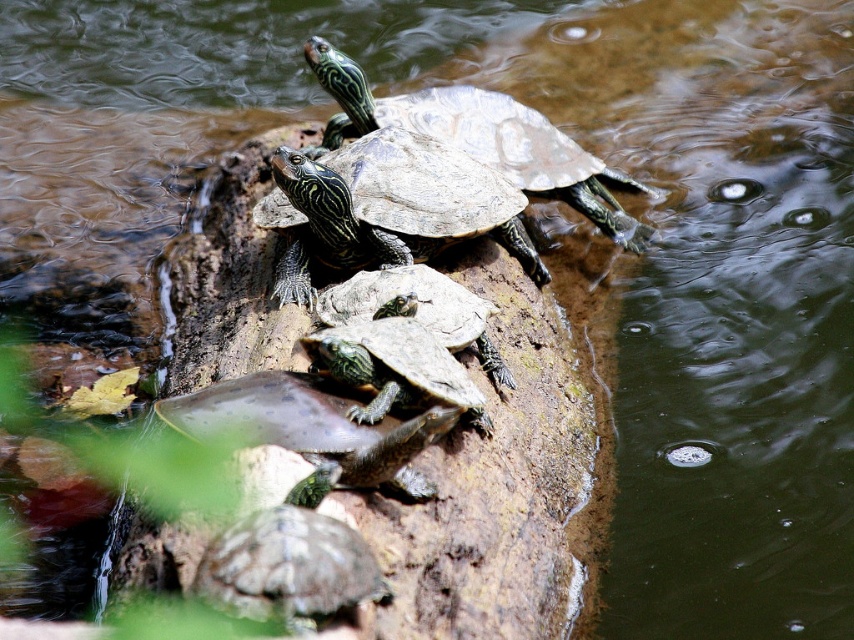
Can you confirm if shiny dark green tortoise at center is bigger than green textured tortoise at center?

Indeed, shiny dark green tortoise at center has a larger size compared to green textured tortoise at center.

Is point (285, 280) farther from camera compared to point (471, 323)?

Yes, point (285, 280) is behind point (471, 323).

Locate an element on the screen. Image resolution: width=854 pixels, height=640 pixels. shiny dark green tortoise at center is located at coordinates (385, 209).

The height and width of the screenshot is (640, 854). Find the location of `shiny dark green tortoise at center`. shiny dark green tortoise at center is located at coordinates (385, 209).

Is green scaly tortoise at center positioned in front of shiny green tortoise at lower center?

No, green scaly tortoise at center is behind shiny green tortoise at lower center.

Is green scaly tortoise at center below shiny green tortoise at lower center?

Actually, green scaly tortoise at center is above shiny green tortoise at lower center.

Which is behind, point (185, 403) or point (303, 493)?

The point (185, 403) is behind.

This screenshot has width=854, height=640. Find the location of `green scaly tortoise at center`. green scaly tortoise at center is located at coordinates [x=313, y=428].

Can you confirm if shiny dark green tortoise at center is positioned below green scaly turtle at center?

Incorrect, shiny dark green tortoise at center is not positioned below green scaly turtle at center.

Between shiny dark green tortoise at center and green scaly turtle at center, which one has less height?

With less height is green scaly turtle at center.

Does point (334, 230) come behind point (319, 371)?

That is True.

The image size is (854, 640). I want to click on shiny dark green tortoise at center, so pos(385,209).